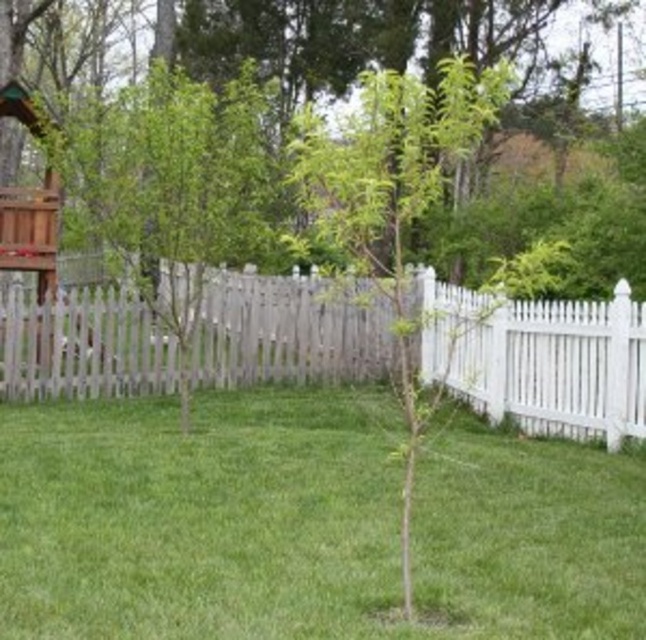
Does green grass at center appear under green leafy tree at center?

Correct, green grass at center is located below green leafy tree at center.

Which is behind, point (590, 474) or point (149, 72)?

The point (149, 72) is behind.

Locate an element on the screen. This screenshot has height=640, width=646. green grass at center is located at coordinates (306, 524).